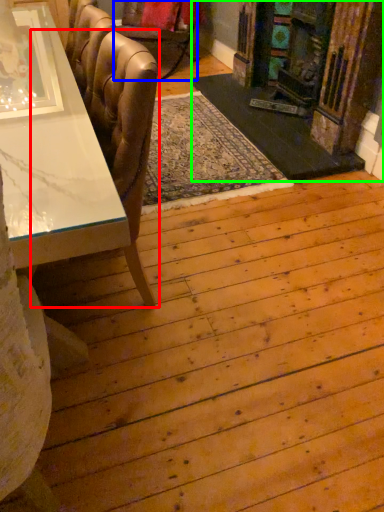
Question: Considering the real-world distances, which object is farthest from chair (highlighted by a red box)? chair (highlighted by a blue box) or fireplace (highlighted by a green box)?

Choices:
 (A) chair
 (B) fireplace

Answer: (A)